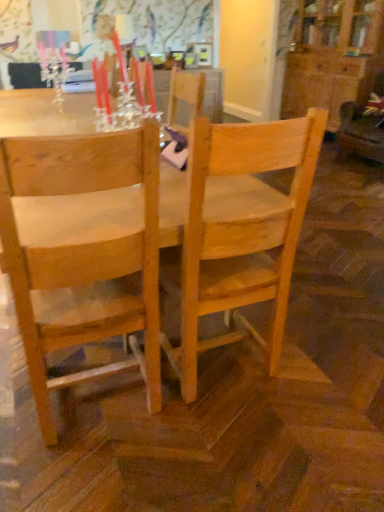
Question: Is matte glass candle holder at upper left closer to the viewer compared to natural wood table at center?

Choices:
 (A) yes
 (B) no

Answer: (B)

Question: Is matte glass candle holder at upper left completely or partially outside of natural wood table at center?

Choices:
 (A) no
 (B) yes

Answer: (B)

Question: From a real-world perspective, is matte glass candle holder at upper left positioned over natural wood table at center based on gravity?

Choices:
 (A) yes
 (B) no

Answer: (A)

Question: From the image's perspective, does matte glass candle holder at upper left appear lower than natural wood table at center?

Choices:
 (A) yes
 (B) no

Answer: (B)

Question: Is matte glass candle holder at upper left bigger than natural wood table at center?

Choices:
 (A) no
 (B) yes

Answer: (A)

Question: Considering the positions of point [49, 55] and point [187, 236], is point [49, 55] closer or farther from the camera than point [187, 236]?

Choices:
 (A) closer
 (B) farther

Answer: (B)

Question: From a real-world perspective, is matte glass candle holder at upper left physically located above or below natural wood chair at center, which is the second chair from left to right?

Choices:
 (A) above
 (B) below

Answer: (A)

Question: In the image, is matte glass candle holder at upper left on the left side or the right side of natural wood chair at center, which is the second chair from left to right?

Choices:
 (A) right
 (B) left

Answer: (B)

Question: Based on their sizes in the image, would you say matte glass candle holder at upper left is bigger or smaller than natural wood chair at center, positioned as the first chair in right-to-left order?

Choices:
 (A) small
 (B) big

Answer: (A)

Question: Does point (46, 222) appear closer or farther from the camera than point (286, 239)?

Choices:
 (A) farther
 (B) closer

Answer: (B)

Question: Looking at the image, does natural wood chair at left, which is the 1th chair from left to right, seem bigger or smaller compared to natural wood table at center?

Choices:
 (A) small
 (B) big

Answer: (A)

Question: Would you say natural wood chair at left, which ranks as the second chair in right-to-left order, is to the left or to the right of natural wood table at center in the picture?

Choices:
 (A) left
 (B) right

Answer: (B)

Question: From a real-world perspective, is natural wood chair at left, which ranks as the second chair in right-to-left order, physically located above or below natural wood table at center?

Choices:
 (A) above
 (B) below

Answer: (A)

Question: Considering the positions of natural wood chair at left, which ranks as the second chair in right-to-left order, and matte glass candle holder at upper left in the image, is natural wood chair at left, which ranks as the second chair in right-to-left order, bigger or smaller than matte glass candle holder at upper left?

Choices:
 (A) big
 (B) small

Answer: (A)

Question: Choose the correct answer: Is natural wood chair at left, which is the 1th chair from left to right, inside matte glass candle holder at upper left or outside it?

Choices:
 (A) outside
 (B) inside

Answer: (A)